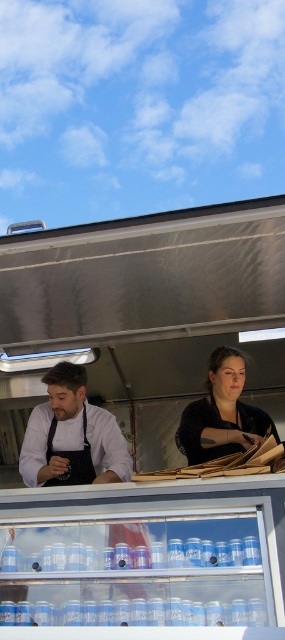
What are the coordinates of the matte black apron at left?

The coordinates of the matte black apron at left are at point (72, 435).

You are a customer observing two aprons on the left side of the food truck. The matte black apron at left and the black fabric apron at left. Which one is positioned more to the right?

The matte black apron at left is positioned more to the right than the black fabric apron at left.